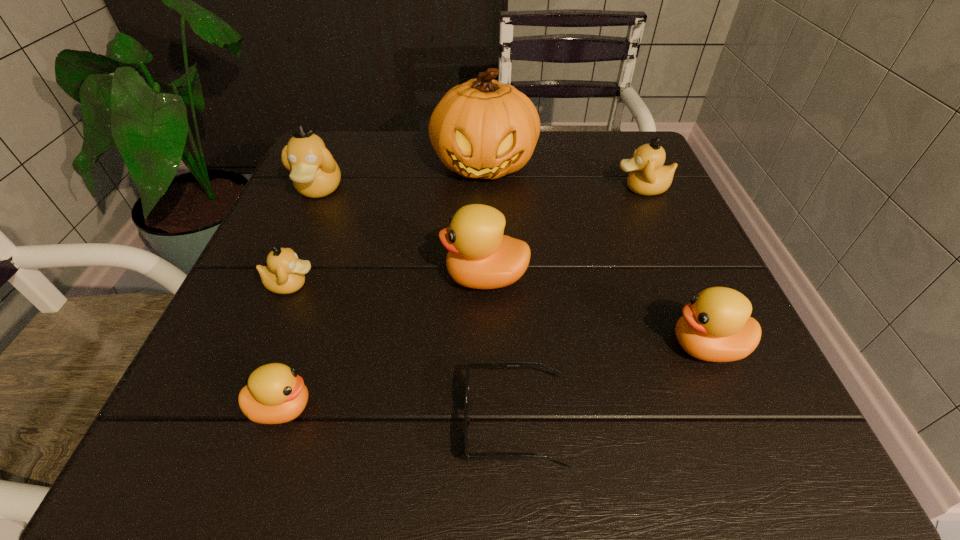
The image size is (960, 540). What are the coordinates of `free space between the biggest tan duckling and the nearest tan duckling` in the screenshot? It's located at (305, 237).

You are a GUI agent. You are given a task and a screenshot of the screen. Output one action in this format:
    pyautogui.click(x=<x>, y=<y>)
    Task: Click on the free space between the sunglasses and the second biggest tan duckling
    The height and width of the screenshot is (540, 960).
    Given the screenshot: What is the action you would take?
    pyautogui.click(x=579, y=305)

Where is `vacant area that lies between the tallest object and the sunglasses`? This screenshot has width=960, height=540. vacant area that lies between the tallest object and the sunglasses is located at coordinates (500, 293).

What are the coordinates of `free space that is in between the smallest tan duckling and the tallest object` in the screenshot? It's located at (388, 225).

Locate an element on the screen. vacant area that lies between the second yellow duckling from left to right and the shortest object is located at coordinates (500, 349).

At what (x,y) coordinates should I click in order to perform the action: click on vacant space that is in between the smallest yellow duckling and the pumpkin. Please return your answer as a coordinate pair (x, y). Looking at the image, I should click on (383, 286).

Identify the location of vacant area that lies between the rightmost yellow duckling and the sunglasses. (612, 384).

Point out which object is positioned as the nearest to the second yellow duckling from right to left. Please provide its 2D coordinates. Your answer should be formatted as a tuple, i.e. [(x, y)], where the tuple contains the x and y coordinates of a point satisfying the conditions above.

[(470, 364)]

What are the coordinates of `the sixth closest object to the biggest tan duckling` in the screenshot? It's located at (648, 176).

Identify the location of the fourth closest duckling to the biggest tan duckling. The width and height of the screenshot is (960, 540). (648, 176).